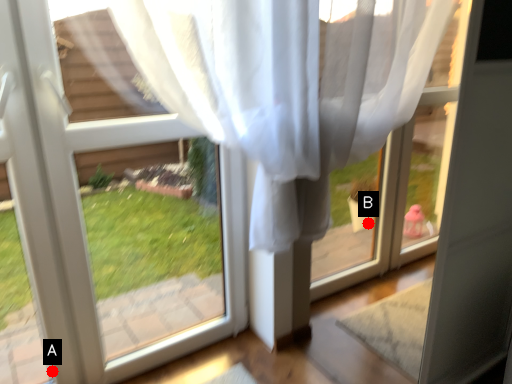
Question: Two points are circled on the image, labeled by A and B beside each circle. Which point is closer to the camera taking this photo?

Choices:
 (A) A is closer
 (B) B is closer

Answer: (A)